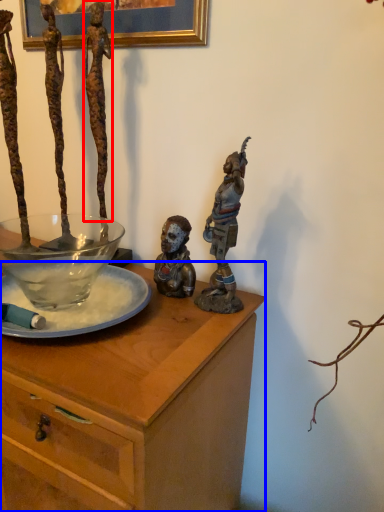
Question: Which object appears closest to the camera in this image, person (highlighted by a red box) or desk (highlighted by a blue box)?

Choices:
 (A) person
 (B) desk

Answer: (B)